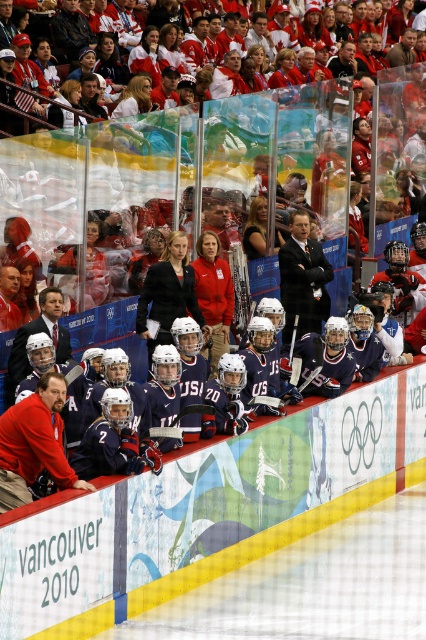
Is matte black hockey at center thinner than blue matte hockey stick at center?

Incorrect, matte black hockey at center's width is not less than blue matte hockey stick at center's.

Does matte black hockey at center have a greater width compared to blue matte hockey stick at center?

Yes, matte black hockey at center is wider than blue matte hockey stick at center.

The image size is (426, 640). What do you see at coordinates (195, 413) in the screenshot?
I see `matte black hockey at center` at bounding box center [195, 413].

Where is `matte black hockey at center`? matte black hockey at center is located at coordinates [x=195, y=413].

Which is behind, point (293, 228) or point (261, 400)?

The point (293, 228) is behind.

Is dark blue suit at center positioned before blue matte hockey stick at center?

No, it is not.

Is point (316, 272) farther from camera compared to point (305, 385)?

Yes.

What are the coordinates of `dark blue suit at center` in the screenshot? It's located at (302, 278).

Who is lower down, red fabric jacket at lower left or blue matte hockey stick at center?

red fabric jacket at lower left is below.

Does red fabric jacket at lower left have a greater width compared to blue matte hockey stick at center?

Correct, the width of red fabric jacket at lower left exceeds that of blue matte hockey stick at center.

Is point (23, 465) closer to viewer compared to point (271, 400)?

Yes.

At what (x,y) coordinates should I click in order to perform the action: click on red fabric jacket at lower left. Please return your answer as a coordinate pair (x, y). This screenshot has width=426, height=640. Looking at the image, I should click on (34, 444).